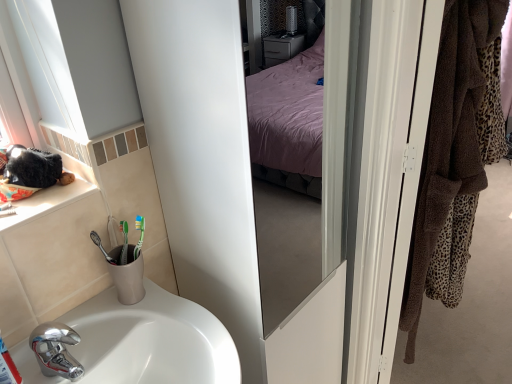
Question: Considering their positions, is brown towel at right located in front of or behind white ceramic window sill at left?

Choices:
 (A) front
 (B) behind

Answer: (B)

Question: Is brown towel at right spatially inside white ceramic window sill at left, or outside of it?

Choices:
 (A) outside
 (B) inside

Answer: (A)

Question: Estimate the real-world distances between objects in this image. Which object is farther from the white glossy screen door at right?

Choices:
 (A) brown towel at right
 (B) white glossy sink at lower left
 (C) white ceramic window sill at left

Answer: (C)

Question: Which is farther from the white ceramic window sill at left?

Choices:
 (A) brown towel at right
 (B) white glossy sink at lower left
 (C) white glossy screen door at right

Answer: (A)